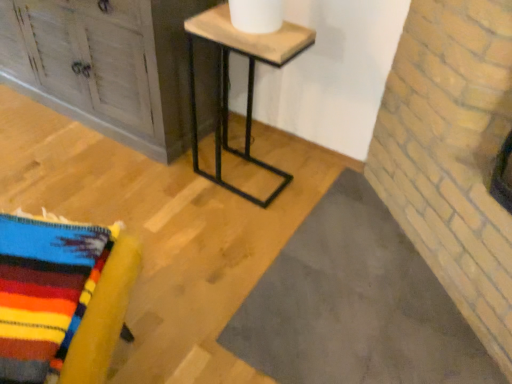
Question: Can knitted wool blanket at lower left, which ranks as the first furniture in bottom-to-top order, be found inside wooden/marble table at center?

Choices:
 (A) no
 (B) yes

Answer: (A)

Question: Is wooden/marble table at center further to camera compared to knitted wool blanket at lower left, which is the second furniture in back-to-front order?

Choices:
 (A) yes
 (B) no

Answer: (A)

Question: Is wooden/marble table at center shorter than knitted wool blanket at lower left, positioned as the second furniture in top-to-bottom order?

Choices:
 (A) yes
 (B) no

Answer: (B)

Question: Considering the relative sizes of wooden/marble table at center and knitted wool blanket at lower left, which is the second furniture in back-to-front order, in the image provided, is wooden/marble table at center smaller than knitted wool blanket at lower left, which is the second furniture in back-to-front order,?

Choices:
 (A) yes
 (B) no

Answer: (B)

Question: Is wooden/marble table at center not within knitted wool blanket at lower left, which ranks as the first furniture in bottom-to-top order?

Choices:
 (A) yes
 (B) no

Answer: (A)

Question: From a real-world perspective, is wooden/marble table at center on knitted wool blanket at lower left, which ranks as the 1th furniture in front-to-back order?

Choices:
 (A) no
 (B) yes

Answer: (B)

Question: From the image's perspective, is knitted wool blanket at lower left, which ranks as the first furniture in bottom-to-top order, under distressed wood cabinet at upper left, arranged as the first furniture when viewed from the top?

Choices:
 (A) yes
 (B) no

Answer: (A)

Question: From a real-world perspective, is knitted wool blanket at lower left, which ranks as the 1th furniture in front-to-back order, physically above distressed wood cabinet at upper left, the 2th furniture positioned from the bottom?

Choices:
 (A) yes
 (B) no

Answer: (B)

Question: From the image's perspective, does knitted wool blanket at lower left, which ranks as the first furniture in bottom-to-top order, appear higher than distressed wood cabinet at upper left, which is the second furniture from front to back?

Choices:
 (A) yes
 (B) no

Answer: (B)

Question: Would you say knitted wool blanket at lower left, which ranks as the 1th furniture in front-to-back order, is outside distressed wood cabinet at upper left, which is the first furniture from back to front?

Choices:
 (A) no
 (B) yes

Answer: (B)

Question: Is knitted wool blanket at lower left, positioned as the second furniture in top-to-bottom order, smaller than distressed wood cabinet at upper left, the 2th furniture positioned from the bottom?

Choices:
 (A) no
 (B) yes

Answer: (B)

Question: Considering the relative sizes of knitted wool blanket at lower left, which ranks as the first furniture in bottom-to-top order, and distressed wood cabinet at upper left, which is the second furniture from front to back, in the image provided, is knitted wool blanket at lower left, which ranks as the first furniture in bottom-to-top order, thinner than distressed wood cabinet at upper left, which is the second furniture from front to back,?

Choices:
 (A) yes
 (B) no

Answer: (A)

Question: From the image's perspective, is distressed wood cabinet at upper left, arranged as the first furniture when viewed from the top, above knitted wool blanket at lower left, which ranks as the 1th furniture in front-to-back order?

Choices:
 (A) no
 (B) yes

Answer: (B)